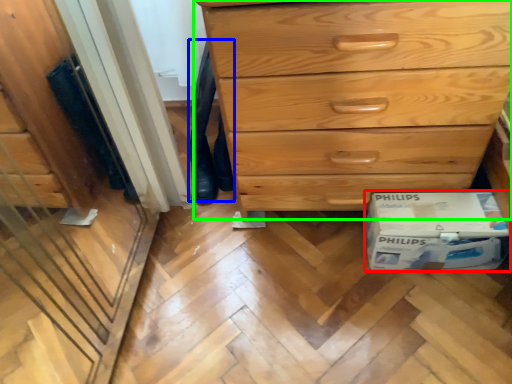
Question: Which is farther away from cardboard box (highlighted by a red box)? jeans (highlighted by a blue box) or chest of drawers (highlighted by a green box)?

Choices:
 (A) jeans
 (B) chest of drawers

Answer: (A)